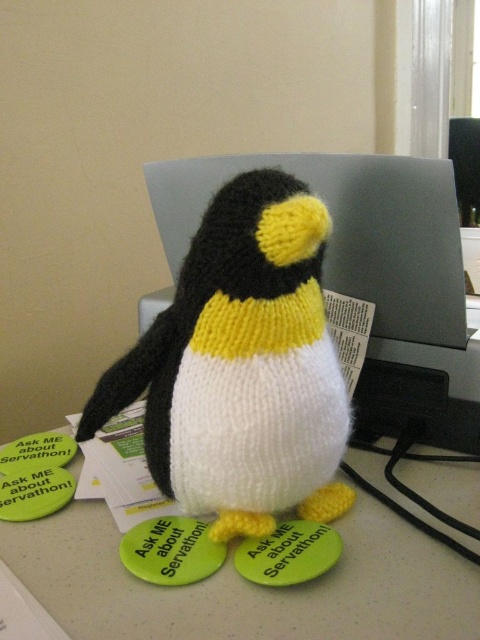
Is knitted black and white penguin at center in front of matte gray computer at center?

Yes, it is in front of matte gray computer at center.

Does point (120, 408) come in front of point (411, 353)?

Yes, point (120, 408) is closer to viewer.

The image size is (480, 640). In order to click on knitted black and white penguin at center in this screenshot , I will do `click(241, 365)`.

Which is in front, point (220, 628) or point (332, 234)?

Point (220, 628) is in front.

Can you confirm if white knitted fabric penguin at center is positioned to the left of matte gray computer at center?

Correct, you'll find white knitted fabric penguin at center to the left of matte gray computer at center.

Is point (472, 582) behind point (186, 173)?

No, it is in front of (186, 173).

The width and height of the screenshot is (480, 640). Identify the location of white knitted fabric penguin at center. (249, 586).

Who is lower down, knitted black and white penguin at center or white knitted fabric penguin at center?

Positioned lower is white knitted fabric penguin at center.

Does knitted black and white penguin at center appear on the right side of white knitted fabric penguin at center?

No, knitted black and white penguin at center is not to the right of white knitted fabric penguin at center.

Is point (229, 372) behind point (389, 572)?

No, it is in front of (389, 572).

I want to click on knitted black and white penguin at center, so (x=241, y=365).